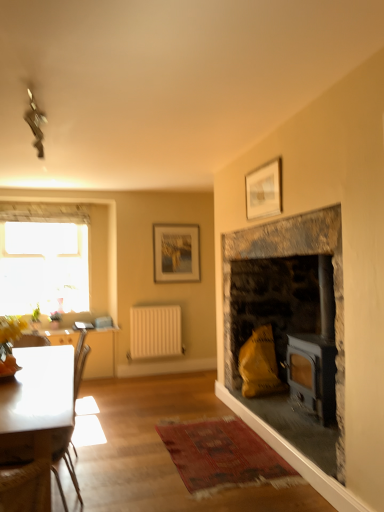
Based on the photo, in order to face white glossy coffee table at lower left, should I rotate leftwards or rightwards?

You should look left and rotate roughly 21.209 degrees.

Locate an element on the screen. Image resolution: width=384 pixels, height=512 pixels. white matte radiator at center is located at coordinates (155, 331).

Can you confirm if white glossy table at left is thinner than matte wooden picture frame at upper center, the second picture frame in the right-to-left sequence?

Incorrect, the width of white glossy table at left is not less than that of matte wooden picture frame at upper center, the second picture frame in the right-to-left sequence.

Considering the positions of objects white glossy table at left and matte wooden picture frame at upper center, which is the 2th picture frame in front-to-back order, in the image provided, who is behind, white glossy table at left or matte wooden picture frame at upper center, which is the 2th picture frame in front-to-back order,?

Positioned behind is matte wooden picture frame at upper center, which is the 2th picture frame in front-to-back order.

Is white glossy table at left not near matte wooden picture frame at upper center, positioned as the 1th picture frame in bottom-to-top order?

That's right, there is a large distance between white glossy table at left and matte wooden picture frame at upper center, positioned as the 1th picture frame in bottom-to-top order.

Is white glossy table at left positioned with its back to matte wooden picture frame at upper center, the first picture frame from the back?

No, matte wooden picture frame at upper center, the first picture frame from the back, is not at the back of white glossy table at left.

From the image's perspective, is matte silver picture frame at upper center, the 2th picture frame when ordered from left to right, located above or below white glossy coffee table at lower left?

matte silver picture frame at upper center, the 2th picture frame when ordered from left to right, is above white glossy coffee table at lower left.

From a real-world perspective, is matte silver picture frame at upper center, acting as the first picture frame starting from the top, beneath white glossy coffee table at lower left?

No.

Which object is thinner, matte silver picture frame at upper center, placed as the first picture frame when sorted from front to back, or white glossy coffee table at lower left?

With smaller width is matte silver picture frame at upper center, placed as the first picture frame when sorted from front to back.

Does matte silver picture frame at upper center, marked as the second picture frame in a bottom-to-top arrangement, have a larger size compared to white matte radiator at center?

Incorrect, matte silver picture frame at upper center, marked as the second picture frame in a bottom-to-top arrangement, is not larger than white matte radiator at center.

Is matte silver picture frame at upper center, marked as the second picture frame in a bottom-to-top arrangement, directly adjacent to white matte radiator at center?

No, matte silver picture frame at upper center, marked as the second picture frame in a bottom-to-top arrangement, is not in contact with white matte radiator at center.

From a real-world perspective, is matte silver picture frame at upper center, marked as the second picture frame in a bottom-to-top arrangement, above or below white matte radiator at center?

From a real-world perspective, matte silver picture frame at upper center, marked as the second picture frame in a bottom-to-top arrangement, is physically above white matte radiator at center.

Does matte silver picture frame at upper center, acting as the first picture frame starting from the top, turn towards white matte radiator at center?

No, matte silver picture frame at upper center, acting as the first picture frame starting from the top, is not turned towards white matte radiator at center.

Which is in front, point (50, 447) or point (243, 238)?

The point (50, 447) is closer.

From a real-world perspective, between white glossy coffee table at lower left and stone fireplace at right, who is vertically higher?

In real-world perspective, stone fireplace at right is above.

From the image's perspective, is white glossy coffee table at lower left on top of stone fireplace at right?

Actually, white glossy coffee table at lower left appears below stone fireplace at right in the image.

Is white glossy coffee table at lower left behind stone fireplace at right?

No, the depth of white glossy coffee table at lower left is less than that of stone fireplace at right.

Is matte wooden picture frame at upper center, the first picture frame from the back, in front of or behind matte silver picture frame at upper center, placed as the first picture frame when sorted from front to back, in the image?

Clearly, matte wooden picture frame at upper center, the first picture frame from the back, is behind matte silver picture frame at upper center, placed as the first picture frame when sorted from front to back.

Can you confirm if matte wooden picture frame at upper center, which is the 2th picture frame in front-to-back order, is shorter than matte silver picture frame at upper center, acting as the first picture frame starting from the top?

In fact, matte wooden picture frame at upper center, which is the 2th picture frame in front-to-back order, may be taller than matte silver picture frame at upper center, acting as the first picture frame starting from the top.

From the image's perspective, is matte wooden picture frame at upper center, the first picture frame from the back, on top of matte silver picture frame at upper center, placed as the first picture frame when sorted from front to back?

No, from the image's perspective, matte wooden picture frame at upper center, the first picture frame from the back, is not above matte silver picture frame at upper center, placed as the first picture frame when sorted from front to back.

Choose the correct answer: Is stone fireplace at right inside white matte radiator at center or outside it?

stone fireplace at right is located beyond the bounds of white matte radiator at center.

In the image, is stone fireplace at right on the left side or the right side of white matte radiator at center?

In the image, stone fireplace at right appears on the right side of white matte radiator at center.

The height and width of the screenshot is (512, 384). I want to click on fireplace above the white matte radiator at center (from a real-world perspective), so click(x=287, y=256).

Based on the photo, which point is more forward, (250,184) or (110,348)?

Positioned in front is point (250,184).

How far apart are matte silver picture frame at upper center, marked as the second picture frame in a bottom-to-top arrangement, and white glossy table at left?

matte silver picture frame at upper center, marked as the second picture frame in a bottom-to-top arrangement, and white glossy table at left are 9.05 feet apart from each other.

Would you consider matte silver picture frame at upper center, the first picture frame positioned from the right, to be distant from white glossy table at left?

Yes, matte silver picture frame at upper center, the first picture frame positioned from the right, and white glossy table at left are quite far apart.

Is matte silver picture frame at upper center, the 2th picture frame when ordered from left to right, oriented away from white glossy table at left?

No, matte silver picture frame at upper center, the 2th picture frame when ordered from left to right, is not facing the opposite direction of white glossy table at left.

The height and width of the screenshot is (512, 384). I want to click on table that is below the matte wooden picture frame at upper center, which is the 2th picture frame in front-to-back order (from the image's perspective), so click(x=101, y=353).

Locate an element on the screen. Image resolution: width=384 pixels, height=512 pixels. coffee table on the left of matte silver picture frame at upper center, marked as the second picture frame in a bottom-to-top arrangement is located at coordinates (38, 398).

Estimate the real-world distances between objects in this image. Which object is closer to transparent glass window at upper left, matte silver picture frame at upper center, marked as the second picture frame in a bottom-to-top arrangement, or white glossy table at left?

white glossy table at left is closer to transparent glass window at upper left.

When comparing their distances from stone fireplace at right, does transparent glass window at upper left or white glossy coffee table at lower left seem closer?

Among the two, white glossy coffee table at lower left is located nearer to stone fireplace at right.

When comparing their distances from matte silver picture frame at upper center, the second picture frame when ordered from back to front, does matte wooden picture frame at upper center, which is the 2th picture frame in front-to-back order, or white glossy table at left seem closer?

matte wooden picture frame at upper center, which is the 2th picture frame in front-to-back order.

Looking at the image, which one is located further to white glossy coffee table at lower left, stone fireplace at right or white matte radiator at center?

white matte radiator at center.

Which object lies nearer to the anchor point white glossy table at left, matte wooden picture frame at upper center, the second picture frame in the right-to-left sequence, or transparent glass window at upper left?

Among the two, transparent glass window at upper left is located nearer to white glossy table at left.

Considering their positions, is white matte radiator at center positioned closer to white glossy table at left than transparent glass window at upper left?

Among the two, white matte radiator at center is located nearer to white glossy table at left.

Looking at the image, which one is located further to stone fireplace at right, white glossy coffee table at lower left or white matte radiator at center?

white matte radiator at center is further to stone fireplace at right.

Based on their spatial positions, is stone fireplace at right or matte silver picture frame at upper center, marked as the second picture frame in a bottom-to-top arrangement, further from white glossy table at left?

matte silver picture frame at upper center, marked as the second picture frame in a bottom-to-top arrangement, is positioned further to the anchor white glossy table at left.

This screenshot has height=512, width=384. Find the location of `fireplace between white glossy coffee table at lower left and transparent glass window at upper left along the z-axis`. fireplace between white glossy coffee table at lower left and transparent glass window at upper left along the z-axis is located at coordinates (287, 256).

Where is `picture frame between white glossy coffee table at lower left and matte wooden picture frame at upper center, the second picture frame in the right-to-left sequence, in the front-back direction`? picture frame between white glossy coffee table at lower left and matte wooden picture frame at upper center, the second picture frame in the right-to-left sequence, in the front-back direction is located at coordinates (264, 190).

Locate an element on the screen. table situated between transparent glass window at upper left and stone fireplace at right from left to right is located at coordinates (101, 353).

The width and height of the screenshot is (384, 512). What are the coordinates of `radiator situated between transparent glass window at upper left and matte wooden picture frame at upper center, the first picture frame from the back, from left to right` in the screenshot? It's located at (155, 331).